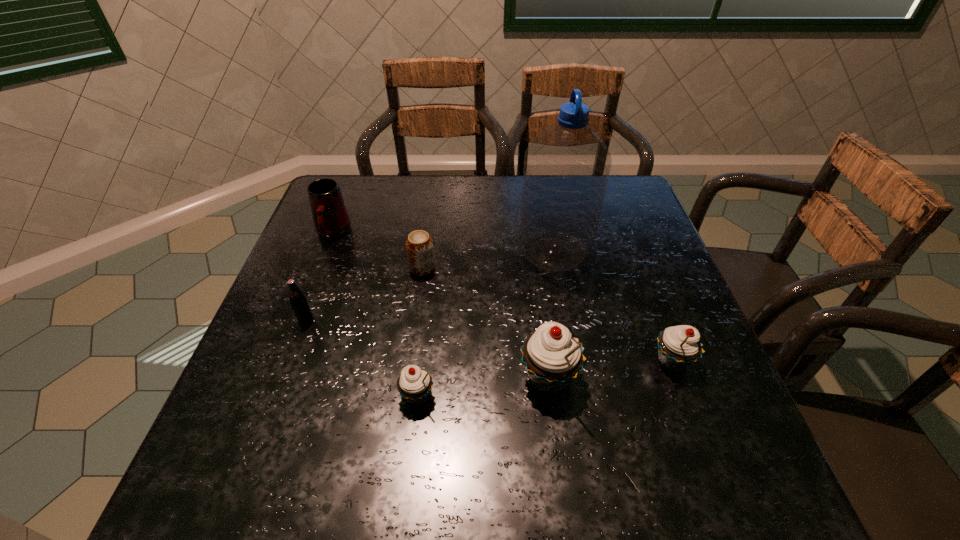
I want to click on vacant space positioned on the back of the tallest cupcake, so click(x=531, y=240).

Where is `free space located 0.080m on the back of the second shortest cupcake`? The image size is (960, 540). free space located 0.080m on the back of the second shortest cupcake is located at coordinates point(655,315).

In order to click on free location located on the right of the tallest object in this screenshot , I will do `click(629, 252)`.

The image size is (960, 540). Find the location of `free space located on the side of the mug with the handle`. free space located on the side of the mug with the handle is located at coordinates (300, 319).

Where is `vacant space located 0.110m on the left of the beer can`? vacant space located 0.110m on the left of the beer can is located at coordinates [x=366, y=268].

Locate an element on the screen. free region located on the front label of the fourth nearest object is located at coordinates click(x=292, y=360).

Find the location of a particular element. object situated at the far edge is located at coordinates (331, 220).

Locate an element on the screen. This screenshot has width=960, height=540. mug positioned at the left edge is located at coordinates (331, 220).

At what (x,y) coordinates should I click in order to perform the action: click on pop positioned at the left edge. Please return your answer as a coordinate pair (x, y). Looking at the image, I should click on (298, 301).

This screenshot has height=540, width=960. I want to click on object that is at the right edge, so click(x=678, y=346).